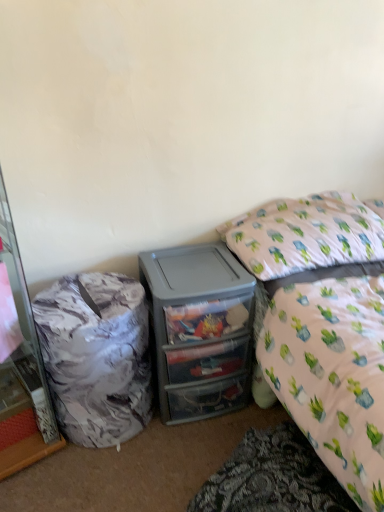
What is the approximate width of marble-patterned cabinet at left?

The width of marble-patterned cabinet at left is 20.86 inches.

Where is `white fabric pillow at upper right`? The width and height of the screenshot is (384, 512). white fabric pillow at upper right is located at coordinates (305, 234).

This screenshot has height=512, width=384. In order to click on marble-patterned cabinet at left in this screenshot , I will do `click(20, 362)`.

Which of these two, white fabric pillow at upper right or marble-patterned trash can at left, is bigger?

A: Bigger between the two is marble-patterned trash can at left.

Considering the sizes of objects white fabric pillow at upper right and marble-patterned trash can at left in the image provided, who is shorter, white fabric pillow at upper right or marble-patterned trash can at left?

Standing shorter between the two is white fabric pillow at upper right.

At what (x,y) coordinates should I click in order to perform the action: click on trash bin/can on the left of white fabric pillow at upper right. Please return your answer as a coordinate pair (x, y). Looking at the image, I should click on (96, 356).

What's the angular difference between white fabric pillow at upper right and marble-patterned trash can at left's facing directions?

The angular difference between white fabric pillow at upper right and marble-patterned trash can at left is 0.443 degrees.

In the scene shown: From a real-world perspective, is translucent plastic drawers at center located beneath marble-patterned trash can at left?

Incorrect, from a real-world perspective, translucent plastic drawers at center is higher than marble-patterned trash can at left.

Considering the relative sizes of translucent plastic drawers at center and marble-patterned trash can at left in the image provided, is translucent plastic drawers at center shorter than marble-patterned trash can at left?

In fact, translucent plastic drawers at center may be taller than marble-patterned trash can at left.

Is translucent plastic drawers at center thinner than marble-patterned trash can at left?

In fact, translucent plastic drawers at center might be wider than marble-patterned trash can at left.

Consider the image. Is translucent plastic drawers at center smaller than marble-patterned trash can at left?

Actually, translucent plastic drawers at center might be larger than marble-patterned trash can at left.

Is marble-patterned trash can at left surrounding white fabric pillow at upper right?

No, white fabric pillow at upper right is located outside of marble-patterned trash can at left.

Is marble-patterned trash can at left wider than white fabric pillow at upper right?

Incorrect, the width of marble-patterned trash can at left does not surpass that of white fabric pillow at upper right.

Which of these two, marble-patterned trash can at left or white fabric pillow at upper right, is bigger?

With larger size is marble-patterned trash can at left.

Considering the relative sizes of white fabric pillow at upper right and translucent plastic drawers at center in the image provided, is white fabric pillow at upper right thinner than translucent plastic drawers at center?

Incorrect, the width of white fabric pillow at upper right is not less than that of translucent plastic drawers at center.

You are a GUI agent. You are given a task and a screenshot of the screen. Output one action in this format:
    pyautogui.click(x=<x>, y=<y>)
    Task: Click on the pillow to the right of translucent plastic drawers at center
    The width and height of the screenshot is (384, 512).
    Given the screenshot: What is the action you would take?
    pyautogui.click(x=305, y=234)

Is white fabric pillow at upper right far away from translucent plastic drawers at center?

No, white fabric pillow at upper right is not far away from translucent plastic drawers at center.

There is a marble-patterned trash can at left. Identify the location of cabinetry above it (from a real-world perspective). The width and height of the screenshot is (384, 512). (20, 362).

From the picture: Is marble-patterned trash can at left outside of marble-patterned cabinet at left?

Yes.

Does marble-patterned trash can at left touch marble-patterned cabinet at left?

There is a gap between marble-patterned trash can at left and marble-patterned cabinet at left.

Would you say translucent plastic drawers at center is part of marble-patterned cabinet at left's contents?

No.

From the image's perspective, is marble-patterned cabinet at left located above or below translucent plastic drawers at center?

marble-patterned cabinet at left is situated higher than translucent plastic drawers at center in the image.

Measure the distance between marble-patterned cabinet at left and translucent plastic drawers at center.

A distance of 22.57 inches exists between marble-patterned cabinet at left and translucent plastic drawers at center.

Considering the sizes of marble-patterned cabinet at left and translucent plastic drawers at center in the image, is marble-patterned cabinet at left bigger or smaller than translucent plastic drawers at center?

In the image, marble-patterned cabinet at left appears to be larger than translucent plastic drawers at center.

Considering the sizes of objects white fabric pillow at upper right and marble-patterned cabinet at left in the image provided, who is smaller, white fabric pillow at upper right or marble-patterned cabinet at left?

Smaller between the two is white fabric pillow at upper right.

How much distance is there between white fabric pillow at upper right and marble-patterned cabinet at left?

A distance of 3.41 feet exists between white fabric pillow at upper right and marble-patterned cabinet at left.

The width and height of the screenshot is (384, 512). I want to click on cabinetry below the white fabric pillow at upper right (from the image's perspective), so click(x=20, y=362).

Does white fabric pillow at upper right have a lesser height compared to marble-patterned cabinet at left?

Correct, white fabric pillow at upper right is not as tall as marble-patterned cabinet at left.

You are a GUI agent. You are given a task and a screenshot of the screen. Output one action in this format:
    pyautogui.click(x=<x>, y=<y>)
    Task: Click on the trash bin/can in front of the white fabric pillow at upper right
    The height and width of the screenshot is (512, 384).
    Given the screenshot: What is the action you would take?
    pyautogui.click(x=96, y=356)

The image size is (384, 512). I want to click on trash bin/can below the translucent plastic drawers at center (from the image's perspective), so click(96, 356).

From the picture: From the image, which object appears to be nearer to white fabric pillow at upper right, marble-patterned trash can at left or marble-patterned cabinet at left?

The object closer to white fabric pillow at upper right is marble-patterned trash can at left.

Based on their spatial positions, is translucent plastic drawers at center or marble-patterned cabinet at left further from white fabric pillow at upper right?

Among the two, marble-patterned cabinet at left is located further to white fabric pillow at upper right.

Based on their spatial positions, is marble-patterned cabinet at left or marble-patterned trash can at left closer to translucent plastic drawers at center?

Among the two, marble-patterned trash can at left is located nearer to translucent plastic drawers at center.

When comparing their distances from marble-patterned trash can at left, does marble-patterned cabinet at left or white fabric pillow at upper right seem further?

white fabric pillow at upper right is further to marble-patterned trash can at left.

Based on their spatial positions, is white fabric pillow at upper right or marble-patterned trash can at left further from translucent plastic drawers at center?

Based on the image, white fabric pillow at upper right appears to be further to translucent plastic drawers at center.

Consider the image. Which object lies further to the anchor point marble-patterned cabinet at left, translucent plastic drawers at center or white fabric pillow at upper right?

The object further to marble-patterned cabinet at left is white fabric pillow at upper right.

From the image, which object appears to be farther from translucent plastic drawers at center, marble-patterned trash can at left or marble-patterned cabinet at left?

marble-patterned cabinet at left.

Looking at the image, which one is located further to white fabric pillow at upper right, marble-patterned cabinet at left or marble-patterned trash can at left?

marble-patterned cabinet at left lies further to white fabric pillow at upper right than the other object.

Identify the location of desk located between marble-patterned trash can at left and white fabric pillow at upper right in the left-right direction. The image size is (384, 512). (199, 329).

This screenshot has height=512, width=384. Find the location of `trash bin/can located between marble-patterned cabinet at left and white fabric pillow at upper right in the left-right direction`. trash bin/can located between marble-patterned cabinet at left and white fabric pillow at upper right in the left-right direction is located at coordinates (96, 356).

Find the location of a particular element. desk between marble-patterned cabinet at left and white fabric pillow at upper right is located at coordinates 199,329.

Image resolution: width=384 pixels, height=512 pixels. What are the coordinates of `trash bin/can between marble-patterned cabinet at left and translucent plastic drawers at center in the horizontal direction` in the screenshot? It's located at (96, 356).